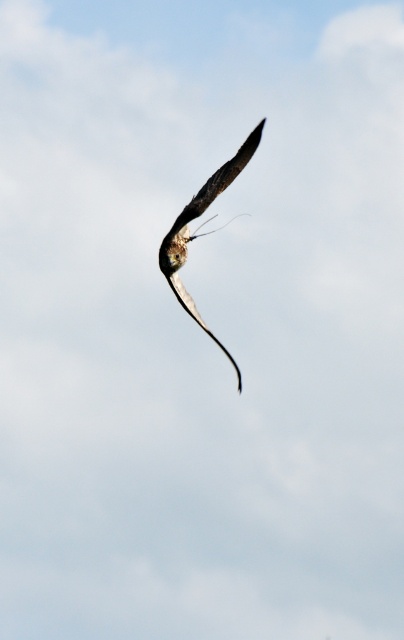
From the picture: You are an ornithologist observing the brown feathered bird at center and the silvery metallic tail at center in the image. Which object is located above the other?

The brown feathered bird at center is positioned over the silvery metallic tail at center, meaning it is above the tail.

You are a wildlife photographer aiming to capture the brown feathered bird at center and the silvery metallic tail at center in a single frame. Based on their sizes, which object should you focus on to ensure both are clearly visible in your photo?

The brown feathered bird at center is larger in size than silvery metallic tail at center, so focusing on the brown feathered bird at center will ensure both are clearly visible in the photo.

You are a photographer trying to capture a clear image of the brown feathered bird at center and the silvery metallic tail at center. Can you fit both subjects into your camera frame that has a maximum width of 1.5 inches?

The brown feathered bird at center and silvery metallic tail at center are 1.36 inches apart from each other, so yes, both subjects can fit into the camera frame since their combined width is less than the 1.5 inches maximum width.